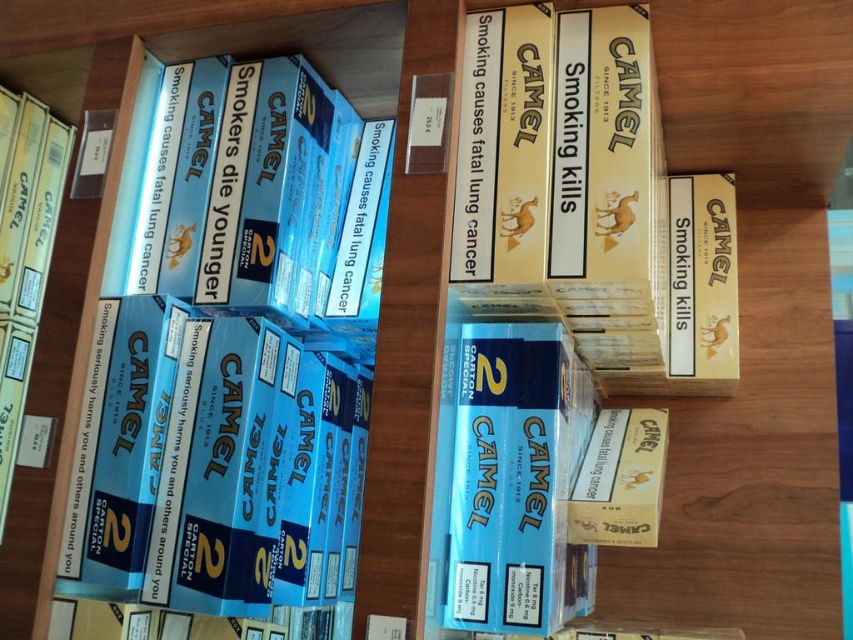
You are standing in front of a shelf of Camel cigarette packs. You notice two points marked on the shelf at coordinates point (453, 330) and point (583, 499). Which point is closer to you?

Point (453, 330) is closer to the camera than point (583, 499).

You are a store employee who needs to place a new item on the shelf. You have a small box that is 10 cm tall. You see the blue cardboard box at left and the matte cardboard book at lower left. Which item can you place the new box on top of without it exceeding the height of the existing items?

The blue cardboard box at left has a greater height compared to the matte cardboard book at lower left. Since the new box is 10 cm tall, you can place it on top of the blue cardboard box at left as it is taller than the matte cardboard book at lower left.

You are a customer looking at the Camel cigarette display. You see a blue cardboard box at left and a matte cardboard book at lower left. Which item is positioned lower on the shelf?

The blue cardboard box at left is located below the matte cardboard book at lower left, so it is positioned lower on the shelf.